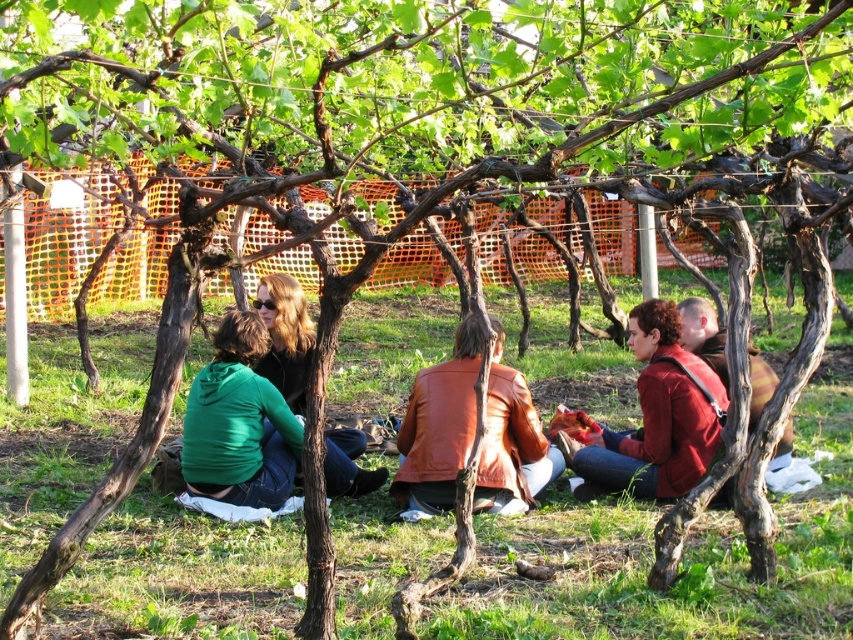
Which is behind, point (410, 488) or point (601, 472)?

Point (601, 472)

Can you confirm if brown leather jacket at center is positioned to the left of matte red jacket at center?

Indeed, brown leather jacket at center is positioned on the left side of matte red jacket at center.

Is point (523, 387) positioned behind point (614, 452)?

No, it is not.

This screenshot has height=640, width=853. What are the coordinates of `brown leather jacket at center` in the screenshot? It's located at (438, 428).

Is brown leather jacket at center to the right of green matte jacket at lower left from the viewer's perspective?

Correct, you'll find brown leather jacket at center to the right of green matte jacket at lower left.

Identify the location of brown leather jacket at center. (438, 428).

The height and width of the screenshot is (640, 853). Describe the element at coordinates (438, 428) in the screenshot. I see `brown leather jacket at center` at that location.

The width and height of the screenshot is (853, 640). I want to click on brown leather jacket at center, so click(438, 428).

This screenshot has height=640, width=853. What do you see at coordinates (654, 417) in the screenshot? I see `matte red jacket at center` at bounding box center [654, 417].

Which is in front, point (637, 353) or point (747, 424)?

Point (747, 424)

The image size is (853, 640). What are the coordinates of `matte red jacket at center` in the screenshot? It's located at (654, 417).